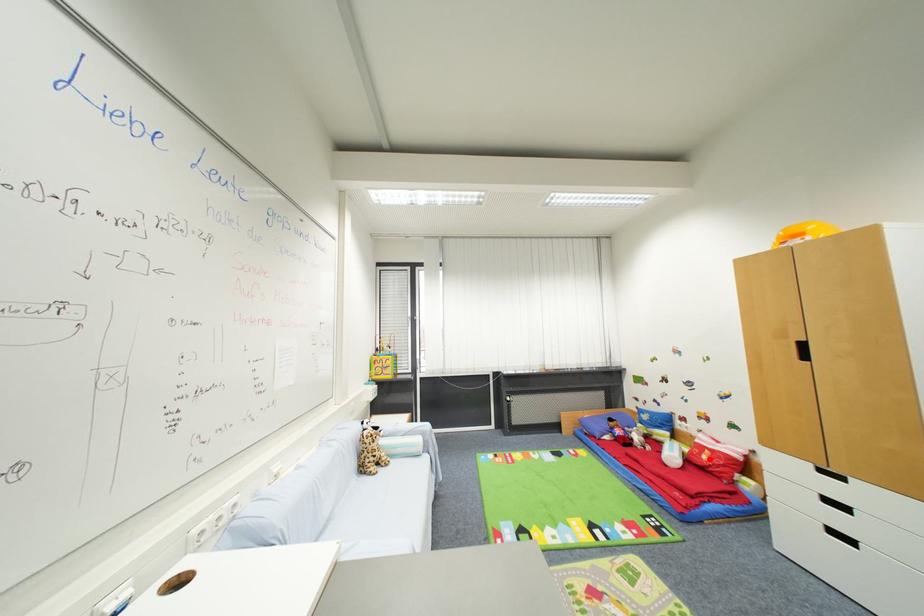
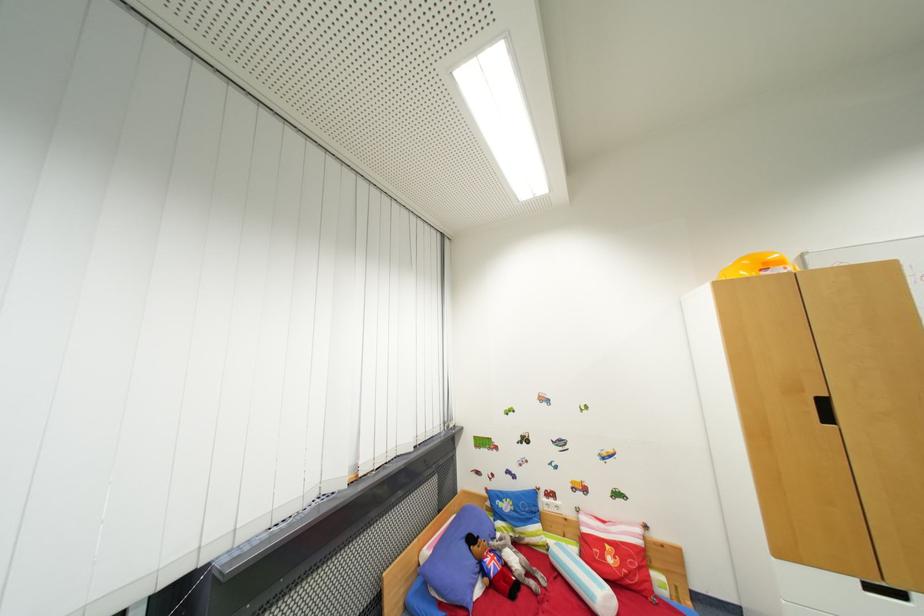
Find the pixel in the second image that matches the highlighted location in the first image.

(614, 562)